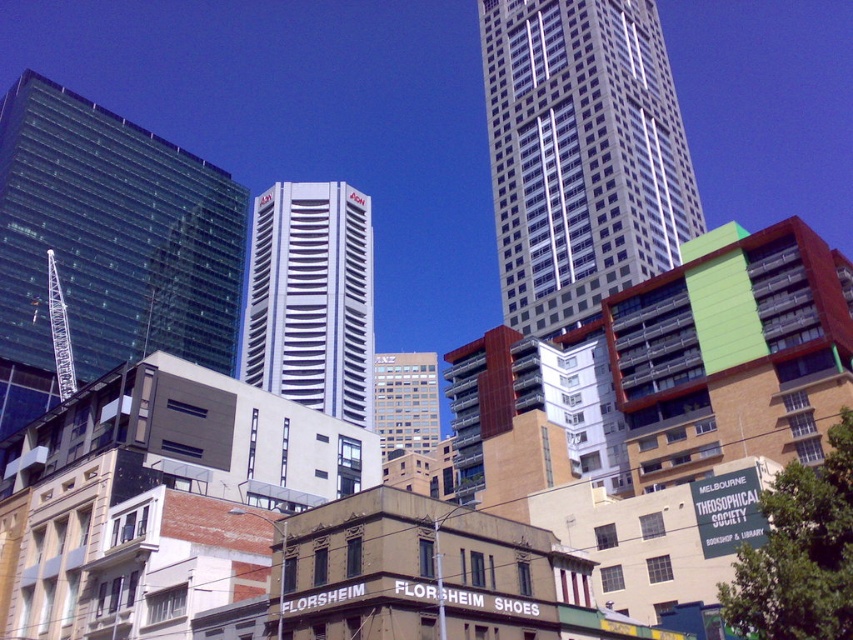
You are an architect analyzing the urban skyline. You notice the white glass skyscraper at center and the white glossy building at center. According to the scene, which one is located to the right of the other?

The white glass skyscraper at center is positioned on the right side of the white glossy building at center.

You are a city planner analyzing the skyline. You need to determine which of the two central buildings, the white glass skyscraper at center or the white glossy building at center, has a greater horizontal span. Based on the scene description, which one is wider?

The white glass skyscraper at center has a greater horizontal span than the white glossy building at center because its width is larger according to the description.